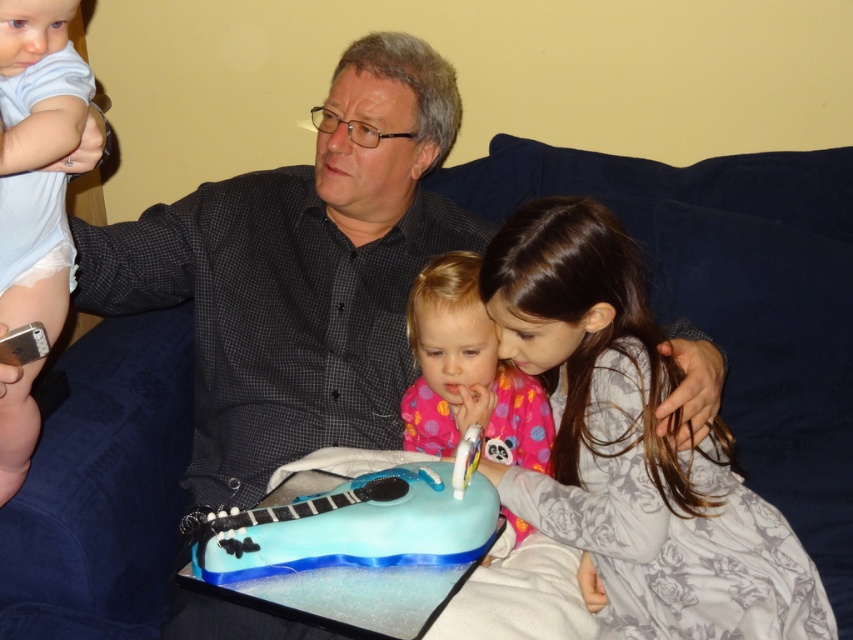
Question: Is pink fabric at center closer to camera compared to light blue cotton onesie at left?

Choices:
 (A) no
 (B) yes

Answer: (A)

Question: Among these points, which one is farthest from the camera?

Choices:
 (A) (590, 388)
 (B) (68, 145)

Answer: (A)

Question: Does fluffy gray dress at lower right appear on the right side of pink fabric at center?

Choices:
 (A) yes
 (B) no

Answer: (A)

Question: Is fluffy gray dress at lower right to the left of pink fabric at center from the viewer's perspective?

Choices:
 (A) no
 (B) yes

Answer: (A)

Question: Which is farther from the fluffy gray dress at lower right?

Choices:
 (A) light blue cotton onesie at left
 (B) pink fabric at center

Answer: (A)

Question: Among these points, which one is farthest from the camera?

Choices:
 (A) (625, 292)
 (B) (16, 285)

Answer: (A)